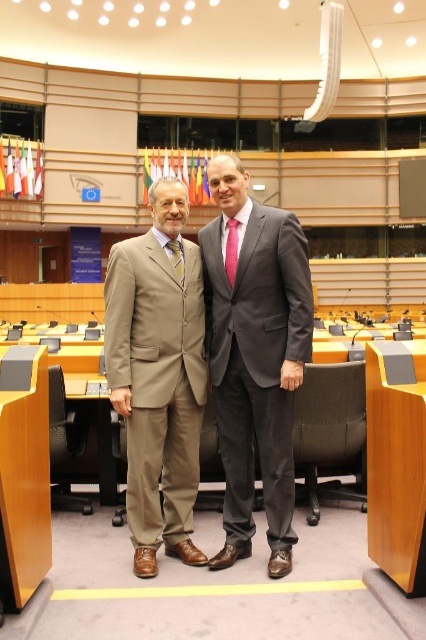
Question: Considering the relative positions of matte beige suit at center and tan fabric suit at center in the image provided, where is matte beige suit at center located with respect to tan fabric suit at center?

Choices:
 (A) left
 (B) right

Answer: (B)

Question: Is tan fabric suit at center smaller than pink satin tie at center?

Choices:
 (A) no
 (B) yes

Answer: (A)

Question: Which object is closer to the camera taking this photo?

Choices:
 (A) dark gray suit at center
 (B) yellowtextured fabrictie at center
 (C) matte beige suit at center

Answer: (C)

Question: Which object is the closest to the tan fabric suit at center?

Choices:
 (A) pink satin tie at center
 (B) dark gray suit at center

Answer: (B)

Question: Which point appears closest to the camera in this image?

Choices:
 (A) (166, 184)
 (B) (267, 515)
 (C) (264, 371)

Answer: (C)

Question: In this image, where is matte beige suit at center located relative to dark gray suit at center?

Choices:
 (A) above
 (B) below

Answer: (A)